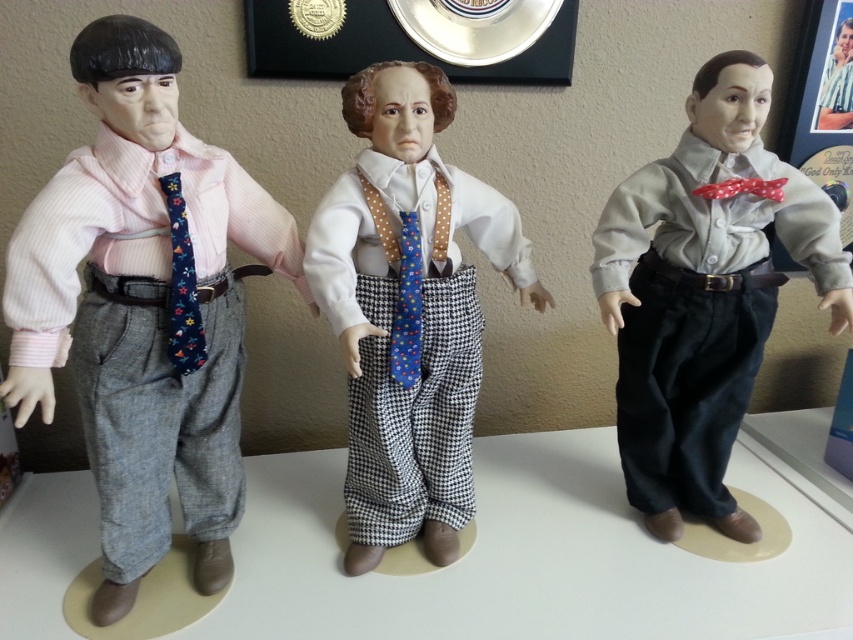
Question: Which object is the farthest from the matte pink shirt at left?

Choices:
 (A) blue floral tie at center
 (B) polka dot fabric tie at center
 (C) floral-patterned fabric tie at center-left
 (D) matte gray shirt at center

Answer: (D)

Question: Can you confirm if matte pink shirt at left is thinner than polka dot fabric tie at center?

Choices:
 (A) no
 (B) yes

Answer: (B)

Question: Which object appears closest to the camera in this image?

Choices:
 (A) polka dot fabric tie at center
 (B) matte pink shirt at left
 (C) blue floral tie at center

Answer: (B)

Question: Which is nearer to the matte pink shirt at left?

Choices:
 (A) blue floral tie at center
 (B) floral-patterned fabric tie at center-left
 (C) matte gray shirt at center

Answer: (B)

Question: Is matte pink shirt at left further to camera compared to floral-patterned fabric tie at center-left?

Choices:
 (A) yes
 (B) no

Answer: (B)

Question: Is floral-patterned fabric tie at center-left bigger than blue floral tie at center?

Choices:
 (A) no
 (B) yes

Answer: (B)